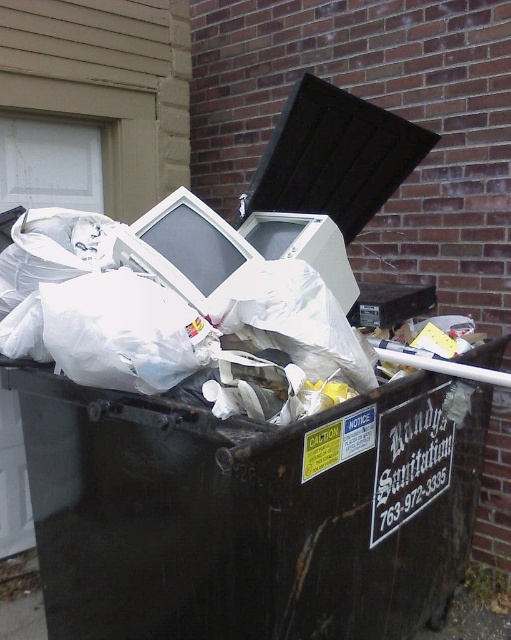
You are a waste collector standing 10 feet away from the dumpster. You need to grab the matte white monitor at center to check its condition before disposal. Can you reach it without moving closer?

The matte white monitor at center is 6.57 feet away from the viewer. Since you are standing 10 feet away, it is within reach without moving closer.